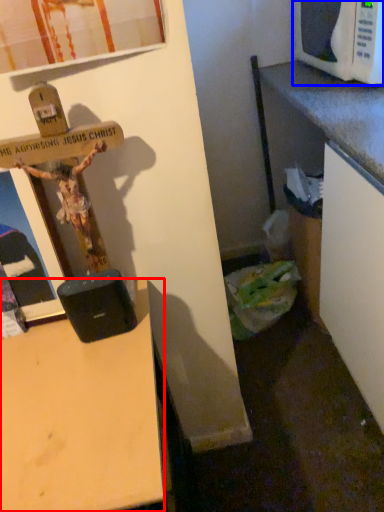
Question: Which object appears farthest to the camera in this image, desk (highlighted by a red box) or microwave oven (highlighted by a blue box)?

Choices:
 (A) desk
 (B) microwave oven

Answer: (B)